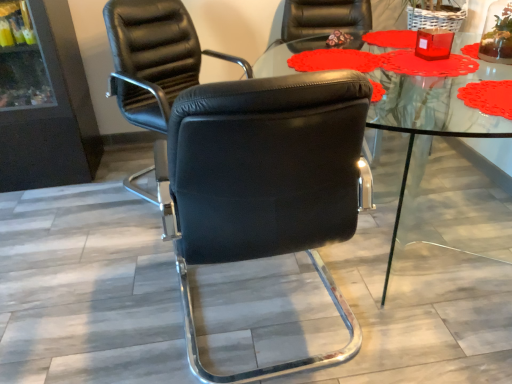
Question: Considering the positions of black leather chair at center, acting as the 1th chair starting from the back, and black leather chair at center, the second chair when ordered from back to front, in the image, is black leather chair at center, acting as the 1th chair starting from the back, wider or thinner than black leather chair at center, the second chair when ordered from back to front,?

Choices:
 (A) wide
 (B) thin

Answer: (B)

Question: In terms of height, does black leather chair at center, acting as the 1th chair starting from the back, look taller or shorter compared to black leather chair at center, the second chair when ordered from back to front?

Choices:
 (A) short
 (B) tall

Answer: (B)

Question: Based on their relative distances, which object is nearer to the black leather chair at center, which ranks as the 2th chair in front-to-back order?

Choices:
 (A) black leather chair at center, the 1th chair from the front
 (B) transparent glass table at center

Answer: (A)

Question: Estimate the real-world distances between objects in this image. Which object is closer to the black leather chair at center, the 1th chair from the front?

Choices:
 (A) transparent glass table at center
 (B) black leather chair at center, acting as the 1th chair starting from the back

Answer: (A)